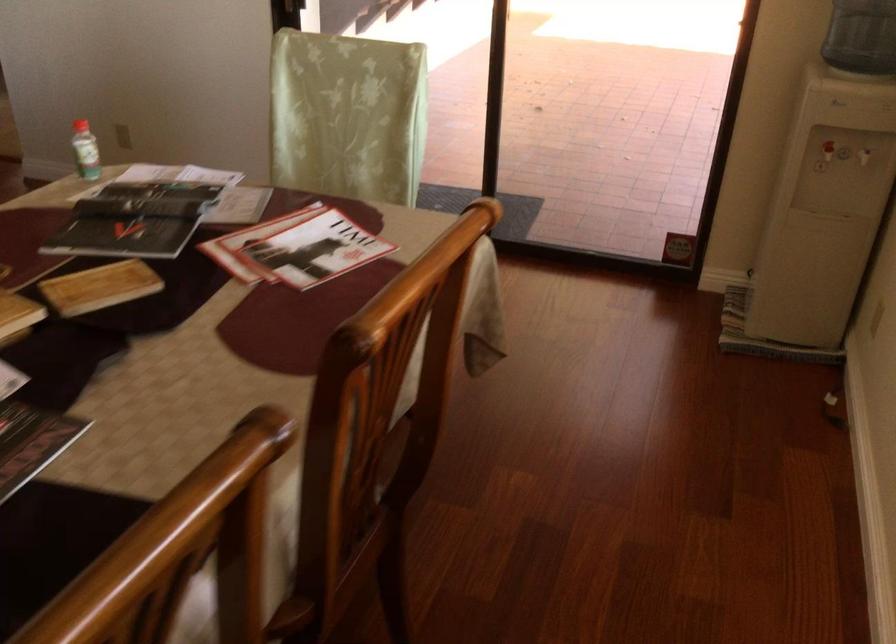
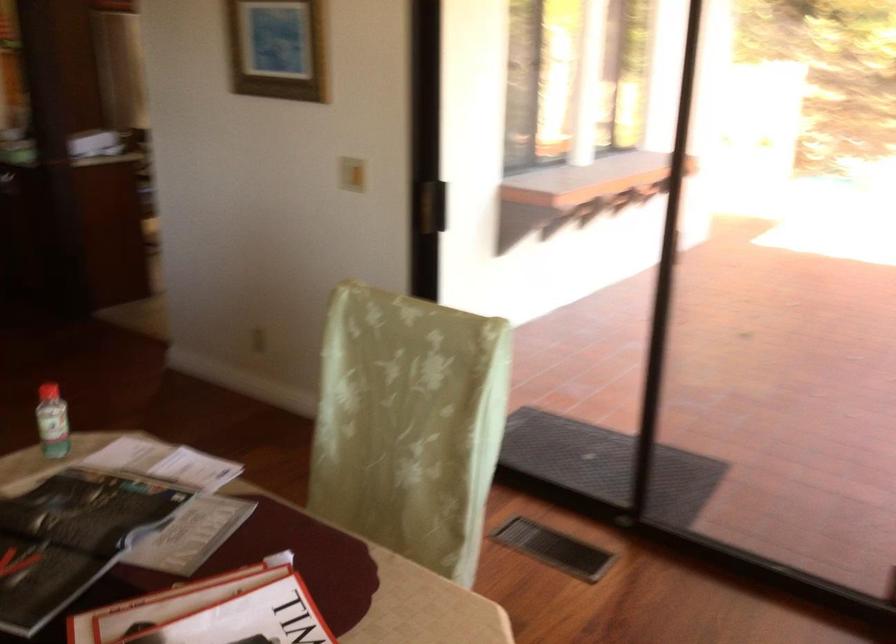
The images are taken continuously from a first-person perspective. In which direction are you moving?

The movement direction of the cameraman is right, forward.